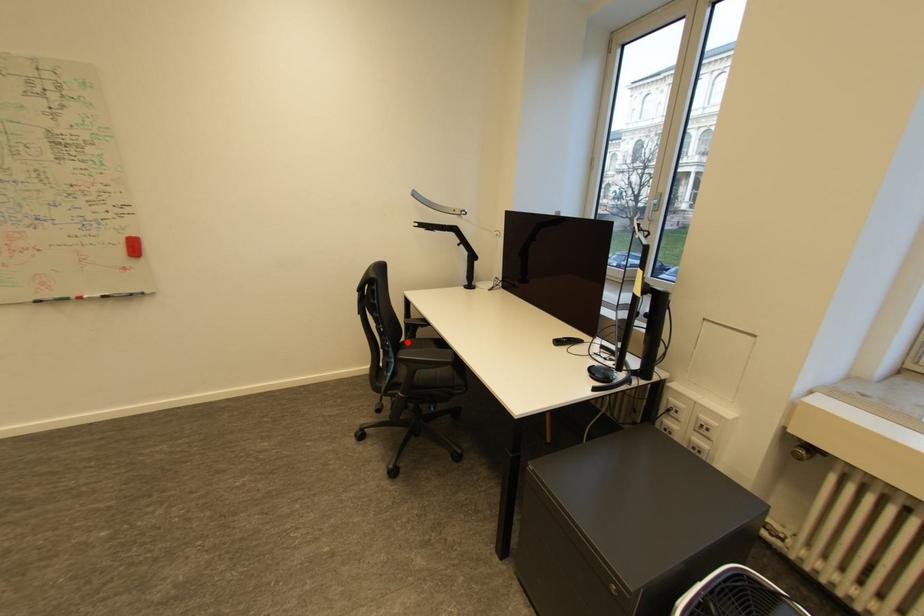
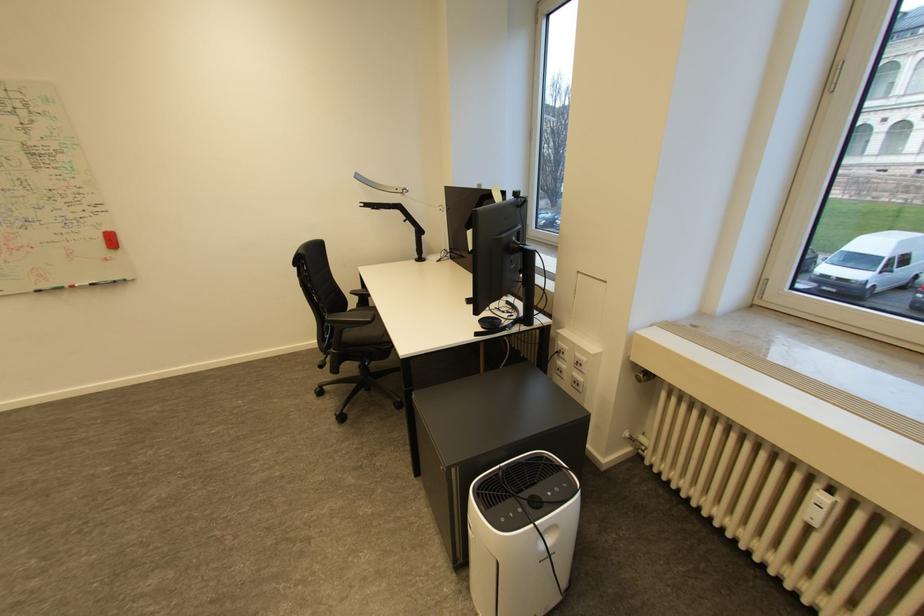
Question: A red point is marked in image1. In image2, is the corresponding 3D point closer to the camera or farther? Reply with the corresponding letter.

Choices:
 (A) The corresponding 3D point is closer.
 (B) The corresponding 3D point is farther.

Answer: (A)